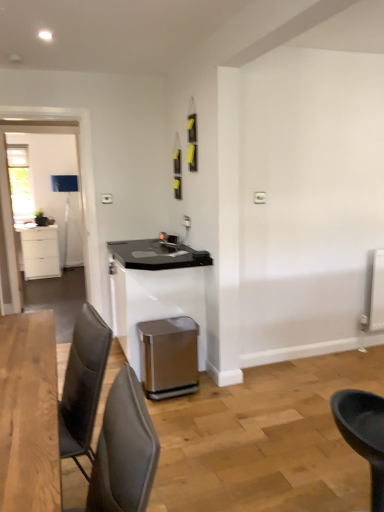
Question: Does satin white table at center have a greater width compared to black plastic chair at lower right, placed as the first chair when sorted from back to front?

Choices:
 (A) no
 (B) yes

Answer: (B)

Question: Are satin white table at center and black plastic chair at lower right, the 2th chair when ordered from left to right, located far from each other?

Choices:
 (A) yes
 (B) no

Answer: (A)

Question: Is satin white table at center outside black plastic chair at lower right, the second chair in the front-to-back sequence?

Choices:
 (A) yes
 (B) no

Answer: (A)

Question: Can you confirm if satin white table at center is shorter than black plastic chair at lower right, placed as the first chair when sorted from right to left?

Choices:
 (A) no
 (B) yes

Answer: (A)

Question: From a real-world perspective, is satin white table at center on top of black plastic chair at lower right, the second chair in the front-to-back sequence?

Choices:
 (A) yes
 (B) no

Answer: (A)

Question: Can you confirm if satin white table at center is smaller than black plastic chair at lower right, placed as the first chair when sorted from back to front?

Choices:
 (A) no
 (B) yes

Answer: (A)

Question: From the image's perspective, is satin metallic trash can at lower center located above gray fabric chair at lower left, the 2th chair positioned from the back?

Choices:
 (A) yes
 (B) no

Answer: (B)

Question: Is satin metallic trash can at lower center thinner than gray fabric chair at lower left, the 2th chair positioned from the back?

Choices:
 (A) yes
 (B) no

Answer: (B)

Question: Is satin metallic trash can at lower center beside gray fabric chair at lower left, the 2th chair positioned from the back?

Choices:
 (A) no
 (B) yes

Answer: (A)

Question: Is satin metallic trash can at lower center facing away from gray fabric chair at lower left, the first chair positioned from the left?

Choices:
 (A) no
 (B) yes

Answer: (A)

Question: Can you confirm if satin metallic trash can at lower center is positioned to the right of gray fabric chair at lower left, the 2th chair positioned from the back?

Choices:
 (A) no
 (B) yes

Answer: (B)

Question: Can you confirm if satin metallic trash can at lower center is positioned to the left of gray fabric chair at lower left, the 2th chair positioned from the back?

Choices:
 (A) yes
 (B) no

Answer: (B)

Question: Is clear glass door at left smaller than black plastic chair at lower right, the second chair in the front-to-back sequence?

Choices:
 (A) yes
 (B) no

Answer: (B)